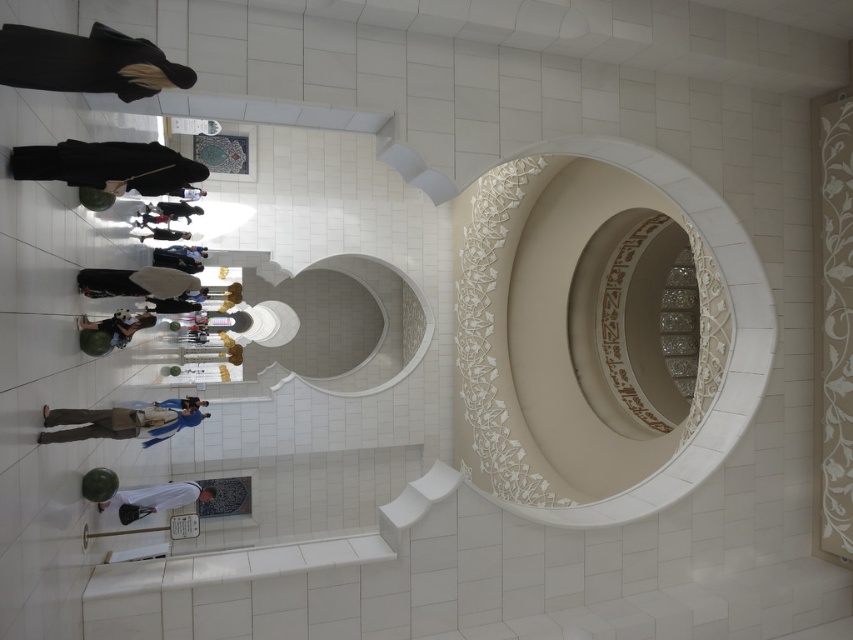
You are standing in the grand space and want to take a photo. There are two points marked in the image, point 1 at coordinates (573, 182) and point 2 at (351, 336). Which point should you focus on first if you want to capture the closest part of the structure in your photo?

Point 1 at coordinates (573, 182) is closer to the camera than point 2 at (351, 336), so you should focus on point 1 first to capture the closest part of the structure in your photo.

You are an interior designer planning to place a large sculpture in this space. You notice the white carved stone at center and the white glossy mirror at center. Which object should you avoid placing the sculpture near if you want to ensure there is enough space?

You should avoid placing the sculpture near the white carved stone at center because it is larger in size than the white glossy mirror at center, leaving less space around it.

You are standing in the grand space and want to place a small potted plant between the white carved stone at center and the white glossy mirror at center. Based on their positions, which object should the plant be closer to?

The white carved stone at center is positioned on the right side of the white glossy mirror at center, so placing the plant between them would mean it is closer to the white carved stone at center.